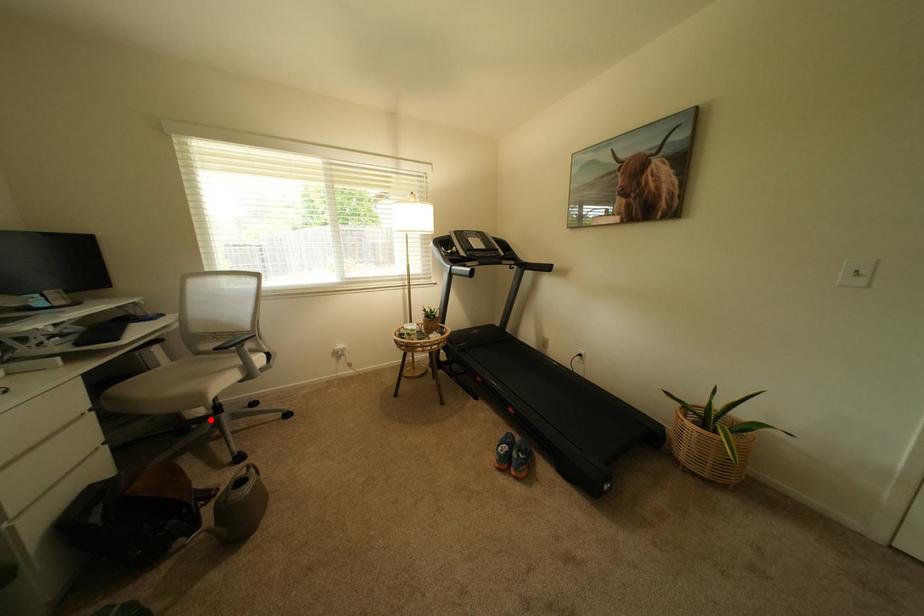
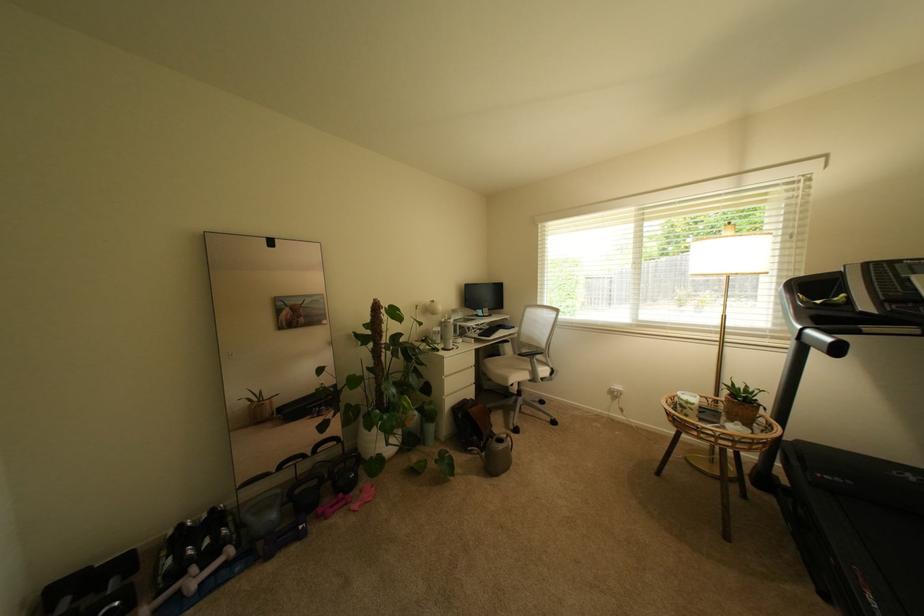
Question: I am providing you with two images of the same scene from different viewpoints. A red point is marked on the first image. Is the red point's position out of view in image 2?

Choices:
 (A) Yes
 (B) No

Answer: (B)